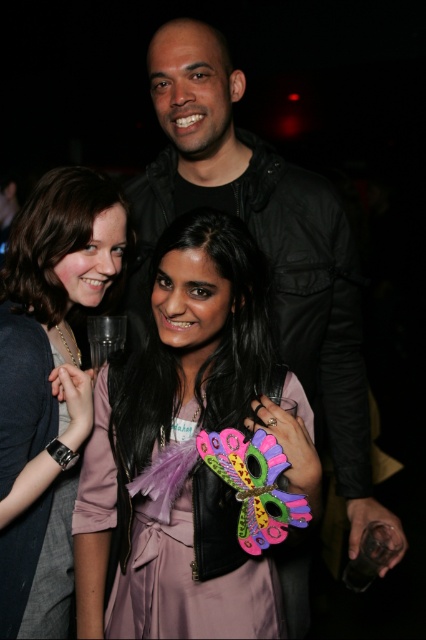
You are a photographer at the event and want to capture both the matte black dress at center and the pink satin dress at center in a single frame. Considering their sizes, which dress might require you to step back to include it fully in the photo?

The matte black dress at center has a larger width than the pink satin dress at center, so you might need to step back to include the matte black dress at center fully in the photo.

You are at the point marked by the coordinates point (285, 257) and want to move to the point marked by point (65, 563). Which direction should you move to reach your destination?

You should move forward because point (285, 257) is behind point (65, 563), so moving forward will bring you closer to your destination.